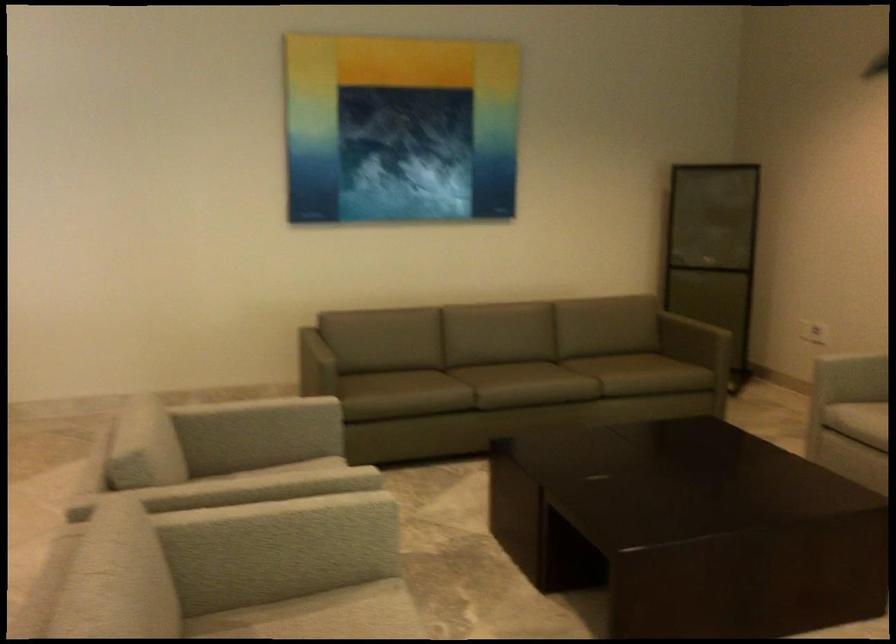
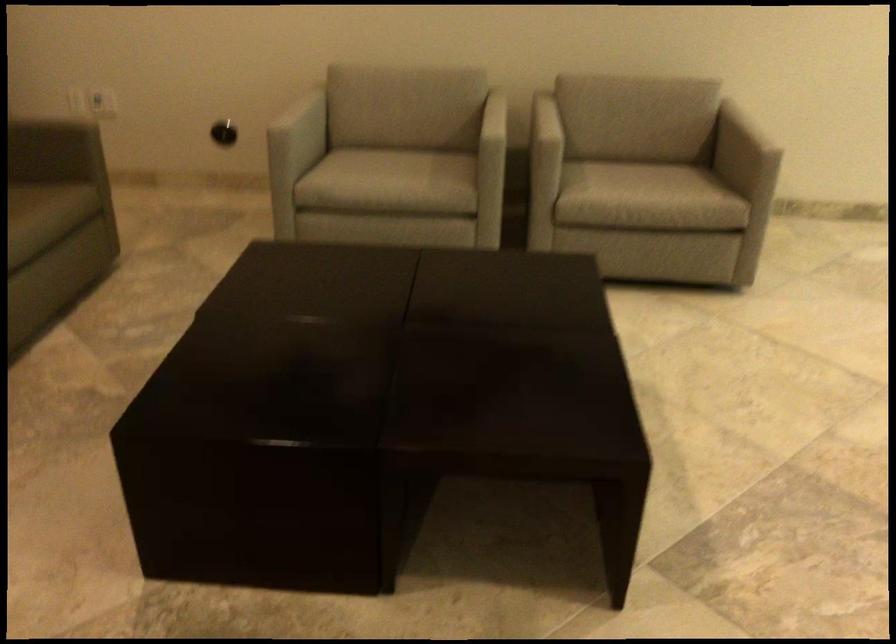
Locate, in the second image, the point that corresponds to (x=642, y=377) in the first image.

(36, 219)